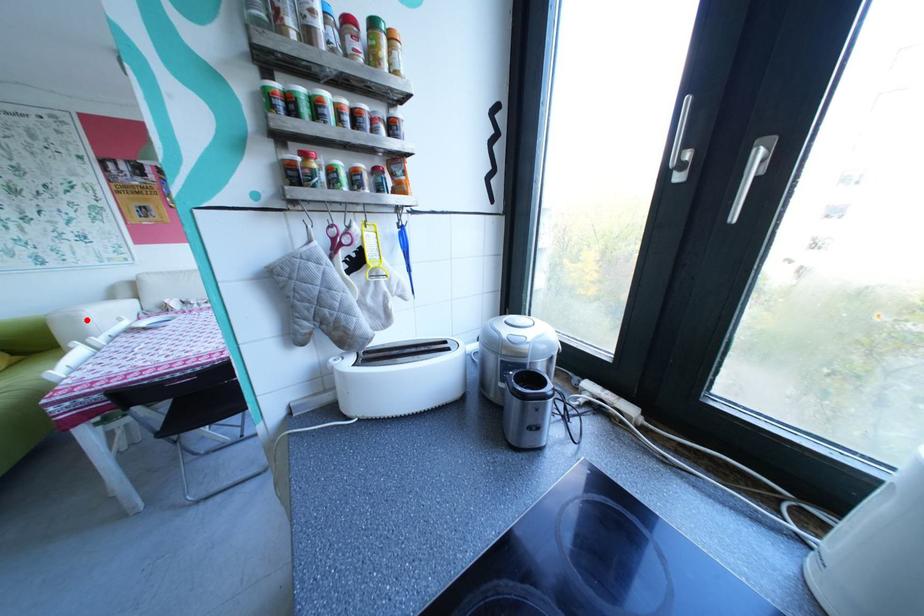
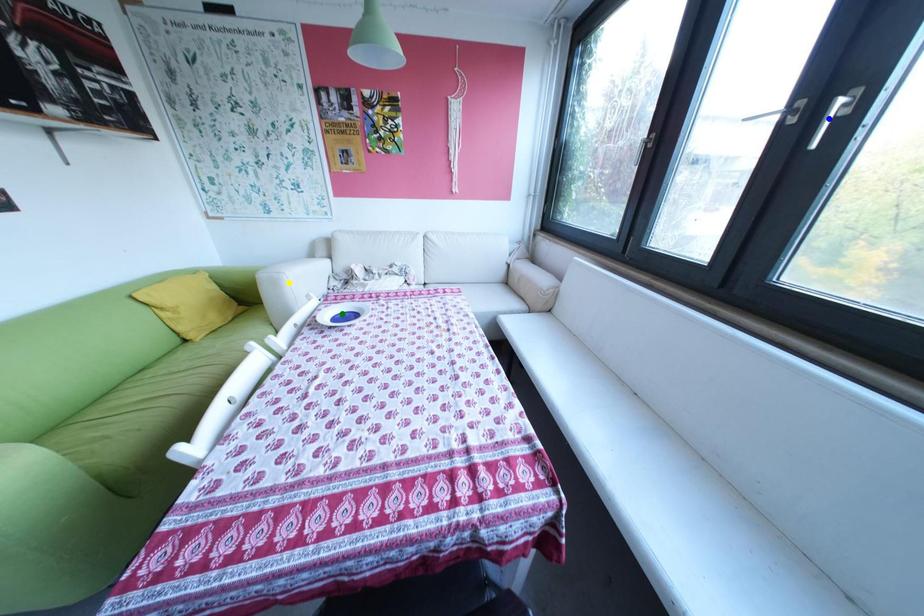
Question: I am providing you with two images of the same scene from different viewpoints. A red point is marked on the first image. You are given multiple points on the second image. Which mark in image 2 goes with the point in image 1?

Choices:
 (A) green point
 (B) blue point
 (C) yellow point

Answer: (C)